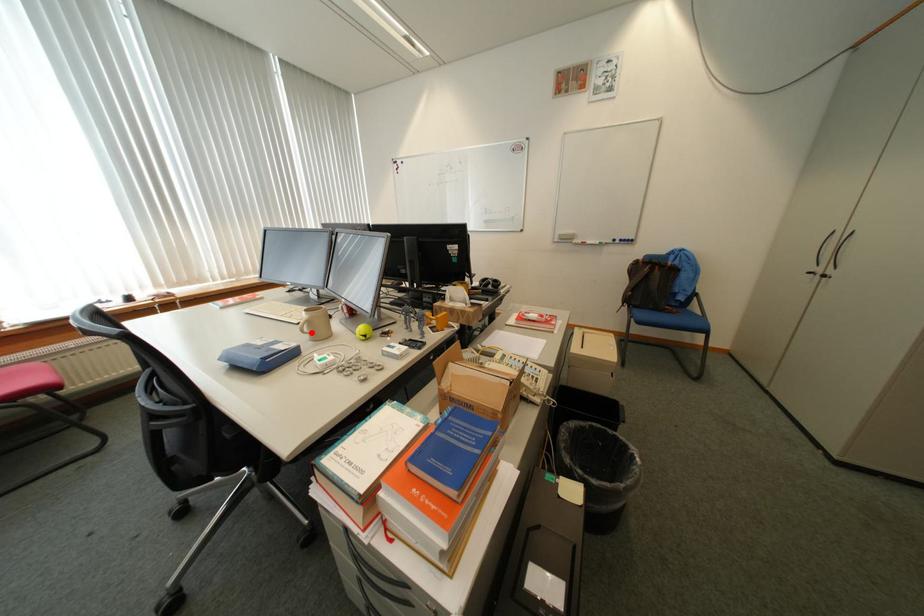
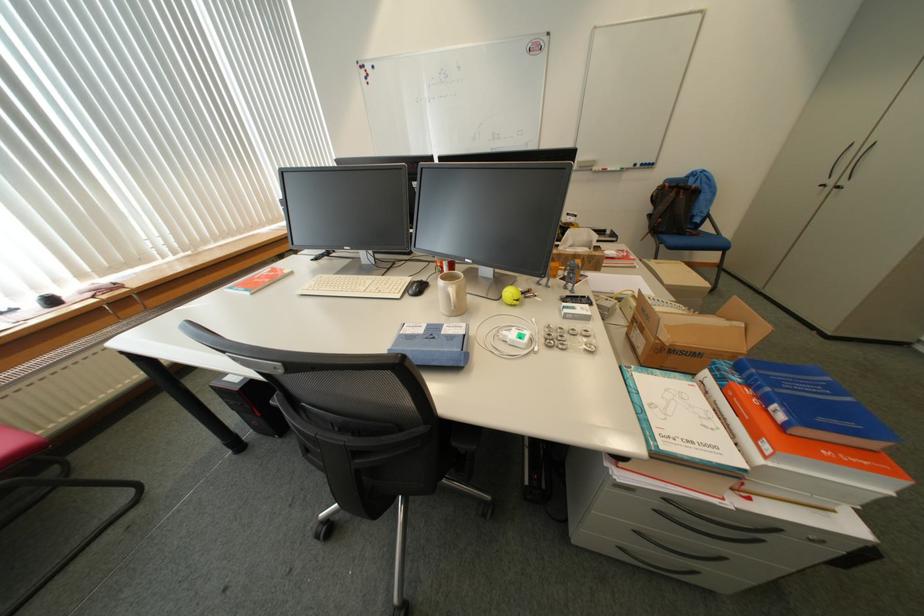
Locate, in the second image, the point that corresponds to the highlighted location in the first image.

(465, 309)